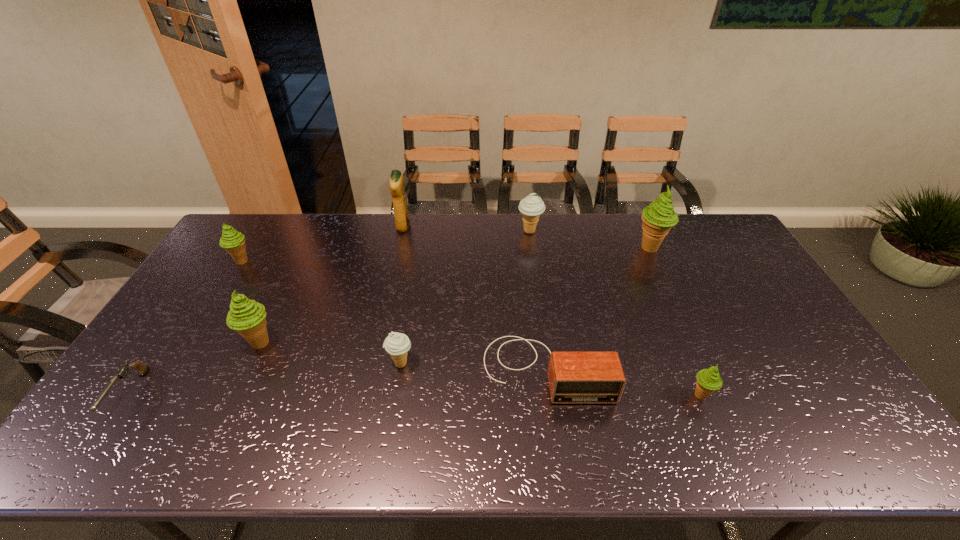
In order to click on vacant area situated on the front of the nearer beige icecream in this screenshot , I will do `click(391, 426)`.

This screenshot has width=960, height=540. What are the coordinates of `vacant space situated on the back of the nearest icecream` in the screenshot? It's located at (673, 330).

Image resolution: width=960 pixels, height=540 pixels. Identify the location of detergent that is at the far edge. (397, 188).

This screenshot has height=540, width=960. I want to click on icecream that is at the left edge, so click(232, 241).

You are a GUI agent. You are given a task and a screenshot of the screen. Output one action in this format:
    pyautogui.click(x=<x>, y=<y>)
    Task: Click on the gun that is at the left edge
    
    Given the screenshot: What is the action you would take?
    click(x=141, y=368)

Locate an element on the screen. The height and width of the screenshot is (540, 960). vacant space at the far edge of the desktop is located at coordinates (577, 231).

You are a GUI agent. You are given a task and a screenshot of the screen. Output one action in this format:
    pyautogui.click(x=<x>, y=<y>)
    Task: Click on the vacant space at the near edge of the desktop
    
    Given the screenshot: What is the action you would take?
    pyautogui.click(x=580, y=434)

The width and height of the screenshot is (960, 540). What are the coordinates of `vacant space at the right edge of the desktop` in the screenshot? It's located at (767, 284).

You are a GUI agent. You are given a task and a screenshot of the screen. Output one action in this format:
    pyautogui.click(x=<x>, y=<y>)
    Task: Click on the free spot at the near left corner of the desktop
    
    Given the screenshot: What is the action you would take?
    pyautogui.click(x=117, y=452)

In the image, there is a desktop. At what (x,y) coordinates should I click in order to perform the action: click on vacant space at the far right corner. Please return your answer as a coordinate pair (x, y). This screenshot has width=960, height=540. Looking at the image, I should click on (x=729, y=242).